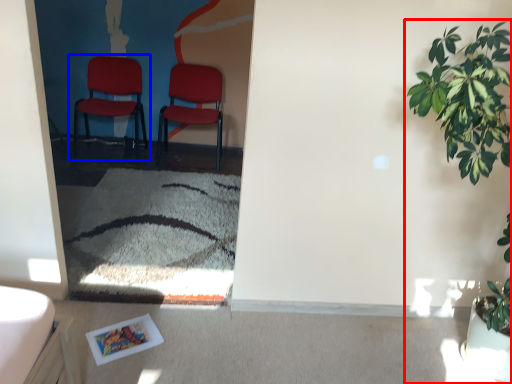
Question: Among these objects, which one is nearest to the camera, houseplant (highlighted by a red box) or chair (highlighted by a blue box)?

Choices:
 (A) houseplant
 (B) chair

Answer: (A)